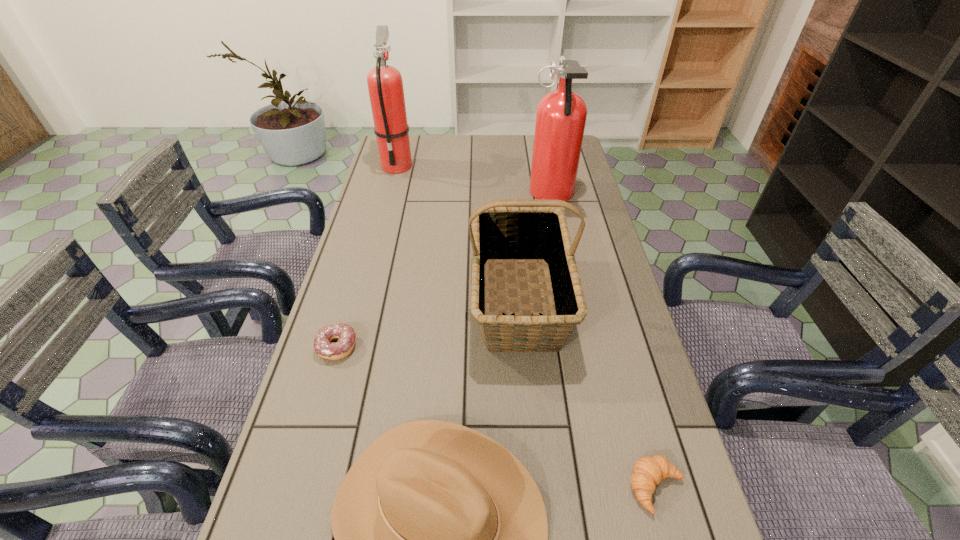
At what (x,y) coordinates should I click in order to perform the action: click on the left fire extinguisher. Please return your answer as a coordinate pair (x, y). The image size is (960, 540). Looking at the image, I should click on (385, 85).

Where is `the right fire extinguisher`? This screenshot has height=540, width=960. the right fire extinguisher is located at coordinates coord(561,115).

The image size is (960, 540). Identify the location of the fourth shortest object. pyautogui.click(x=509, y=231).

Where is `doughnut`? Image resolution: width=960 pixels, height=540 pixels. doughnut is located at coordinates coord(343,347).

This screenshot has width=960, height=540. I want to click on crescent roll, so click(x=648, y=471).

Locate an element on the screen. vacant space located on the hose direction of the left fire extinguisher is located at coordinates (379, 234).

I want to click on blank space located 0.330m on the back of the right fire extinguisher, so click(x=540, y=136).

The height and width of the screenshot is (540, 960). In order to click on vacant space located by the handle of the basket in this screenshot , I will do `click(539, 511)`.

Locate an element on the screen. This screenshot has height=540, width=960. vacant space located on the front of the doughnut is located at coordinates click(326, 386).

Locate an element on the screen. This screenshot has height=540, width=960. vacant region located 0.150m on the back of the crescent roll is located at coordinates (631, 394).